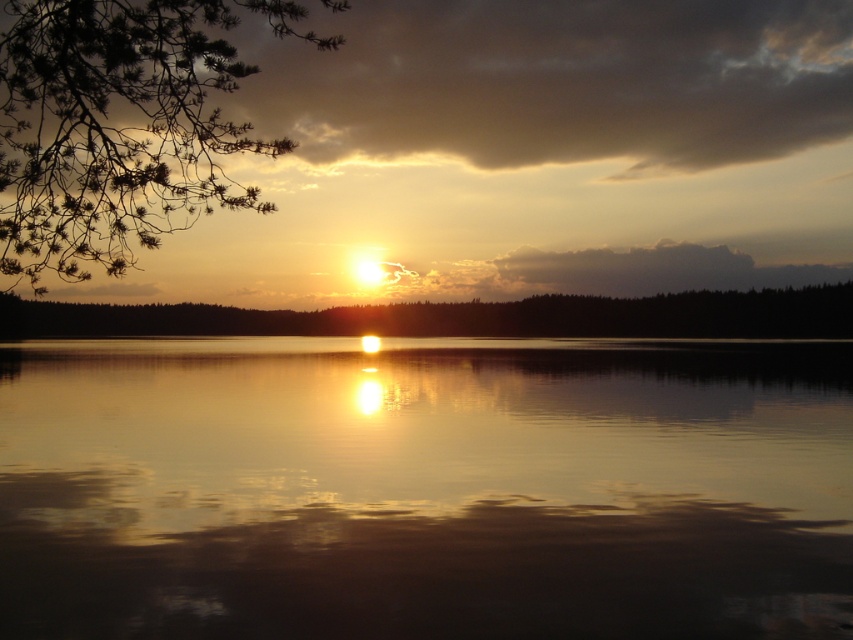
Question: Is the position of glistening reflective water at center less distant than that of green needle-like branches at upper left?

Choices:
 (A) yes
 (B) no

Answer: (A)

Question: Does green needle-like branches at upper left have a greater width compared to green matte tree at center?

Choices:
 (A) no
 (B) yes

Answer: (A)

Question: Which point appears farthest from the camera in this image?

Choices:
 (A) (59, 125)
 (B) (457, 324)
 (C) (579, 465)

Answer: (B)

Question: Among these points, which one is nearest to the camera?

Choices:
 (A) (178, 20)
 (B) (122, 440)

Answer: (A)

Question: Among these points, which one is nearest to the camera?

Choices:
 (A) (28, 240)
 (B) (38, 314)

Answer: (A)

Question: Is glistening reflective water at center smaller than green matte tree at center?

Choices:
 (A) no
 (B) yes

Answer: (B)